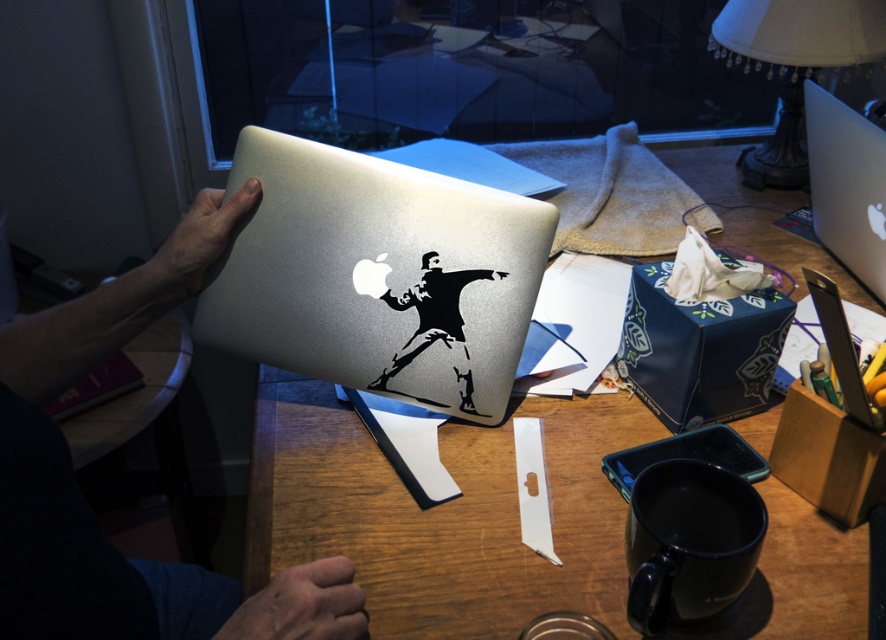
Question: In this image, where is satin silver laptop at center located relative to satin silver laptop at upper right?

Choices:
 (A) left
 (B) right

Answer: (A)

Question: Which of the following is the closest to the observer?

Choices:
 (A) (812, 148)
 (B) (495, 456)
 (C) (89, 538)
 (D) (766, 3)

Answer: (C)

Question: Is satin silver laptop at center below metallic silver laptop at upper center?

Choices:
 (A) no
 (B) yes

Answer: (A)

Question: Considering the real-world distances, which object is farthest from the white fabric lampshade at upper right?

Choices:
 (A) satin silver laptop at center
 (B) satin silver laptop at upper right
 (C) wooden table at center

Answer: (A)

Question: Where is wooden table at center located in relation to white fabric lampshade at upper right in the image?

Choices:
 (A) below
 (B) above

Answer: (A)

Question: Among these points, which one is nearest to the camera?

Choices:
 (A) (x=844, y=244)
 (B) (x=491, y=468)

Answer: (B)